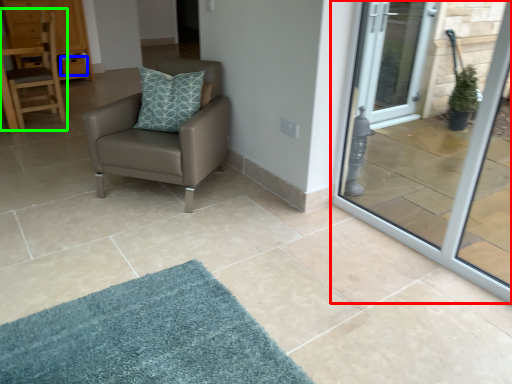
Question: Considering the real-world distances, which object is farthest from door (highlighted by a red box)? drawer (highlighted by a blue box) or chair (highlighted by a green box)?

Choices:
 (A) drawer
 (B) chair

Answer: (A)